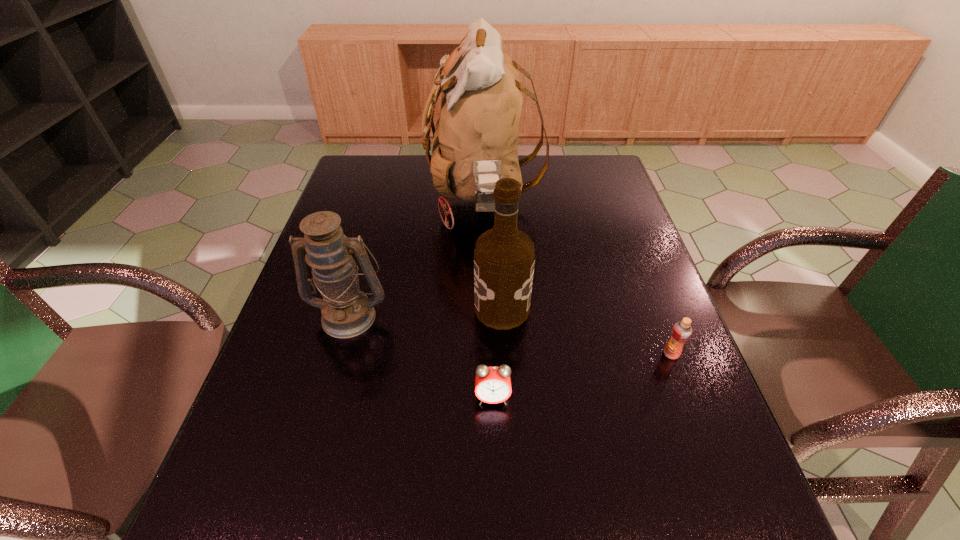
Where is `vacant region between the oil lamp and the alarm clock`? This screenshot has width=960, height=540. vacant region between the oil lamp and the alarm clock is located at coordinates (421, 356).

I want to click on vacant area that lies between the leftmost object and the shortest object, so click(421, 356).

This screenshot has width=960, height=540. What are the coordinates of `free space between the alcohol and the oil lamp` in the screenshot? It's located at (425, 312).

Where is `vacant point located between the fourth shortest object and the fourth tallest object`? The width and height of the screenshot is (960, 540). vacant point located between the fourth shortest object and the fourth tallest object is located at coordinates (587, 331).

This screenshot has width=960, height=540. I want to click on the second closest object to the leftmost object, so click(x=504, y=258).

Select which object is the second closest to the alcohol. Please provide its 2D coordinates. Your answer should be formatted as a tuple, i.e. [(x, y)], where the tuple contains the x and y coordinates of a point satisfying the conditions above.

[(475, 144)]

This screenshot has width=960, height=540. Identify the location of free point that satisfies the following two spatial constraints: 1. on the back side of the fourth tallest object; 2. on the front-facing side of the farthest object. (613, 202).

The width and height of the screenshot is (960, 540). Find the location of `vacant space that satisfies the following two spatial constraints: 1. on the back side of the orange juice; 2. on the label of the second tallest object`. vacant space that satisfies the following two spatial constraints: 1. on the back side of the orange juice; 2. on the label of the second tallest object is located at coordinates point(654,308).

Locate an element on the screen. The height and width of the screenshot is (540, 960). vacant area in the image that satisfies the following two spatial constraints: 1. on the label of the fourth shortest object; 2. on the front side of the leftmost object is located at coordinates (502, 315).